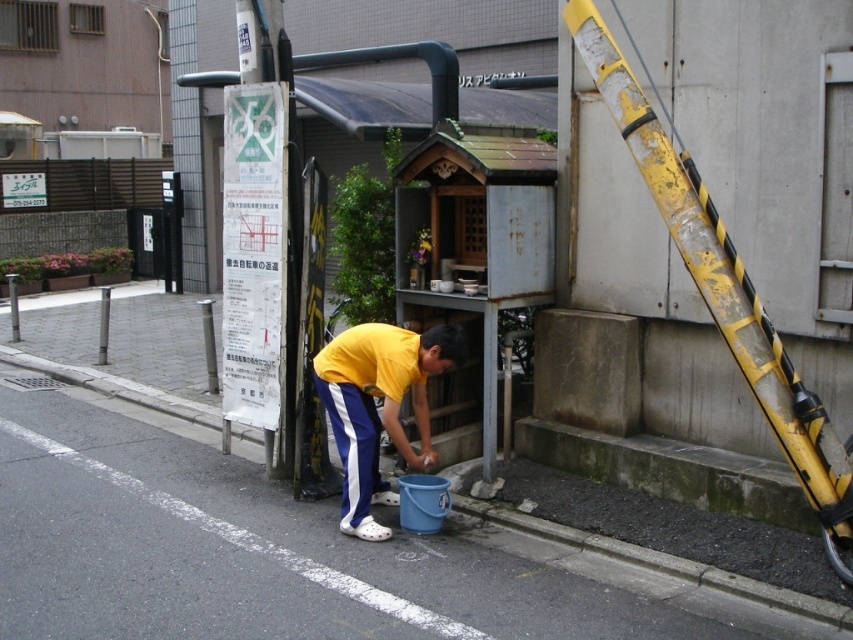
Between blue plastic bucket at lower center and yellow matte/suede shirt at center, which one appears on the right side from the viewer's perspective?

yellow matte/suede shirt at center is more to the right.

Which of these two, blue plastic bucket at lower center or yellow matte/suede shirt at center, stands taller?

With more height is yellow matte/suede shirt at center.

Between point (49, 422) and point (357, 344), which one is positioned in front?

Positioned in front is point (357, 344).

Identify the location of blue plastic bucket at lower center. (285, 552).